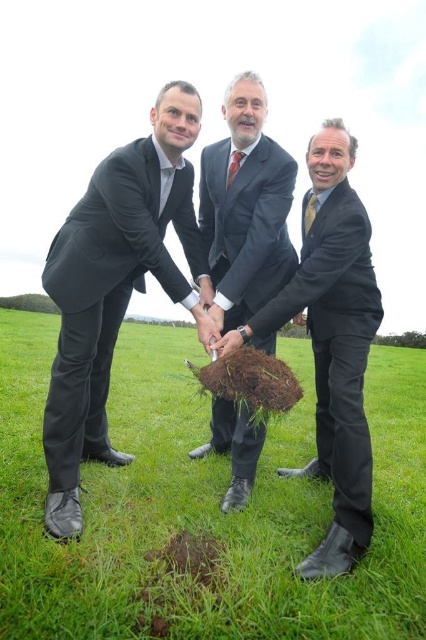
Question: Is black matte suit at left smaller than matte black suit at center?

Choices:
 (A) yes
 (B) no

Answer: (B)

Question: Can you confirm if green grass at center is wider than black suit at center?

Choices:
 (A) yes
 (B) no

Answer: (A)

Question: Which is nearer to the green grass at center?

Choices:
 (A) green leafy tree at center
 (B) black matte suit at left
 (C) matte black suit at center
 (D) black suit at center

Answer: (D)

Question: In this image, where is green grass at center located relative to green leafy tree at center?

Choices:
 (A) above
 (B) below

Answer: (A)

Question: Among these objects, which one is nearest to the camera?

Choices:
 (A) matte black suit at center
 (B) black matte suit at left

Answer: (B)

Question: Estimate the real-world distances between objects in this image. Which object is farther from the black suit at center?

Choices:
 (A) green leafy tree at center
 (B) black matte suit at left
 (C) matte black suit at center
 (D) green grass at center

Answer: (A)